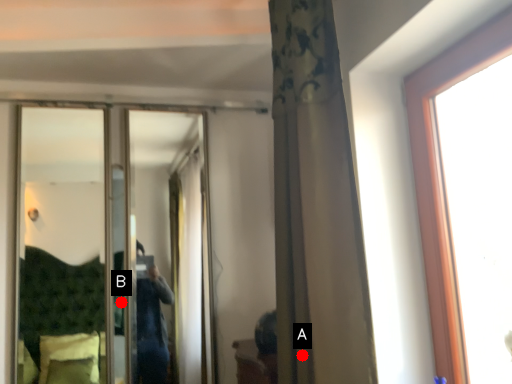
Question: Two points are circled on the image, labeled by A and B beside each circle. Among these points, which one is nearest to the camera?

Choices:
 (A) A is closer
 (B) B is closer

Answer: (A)